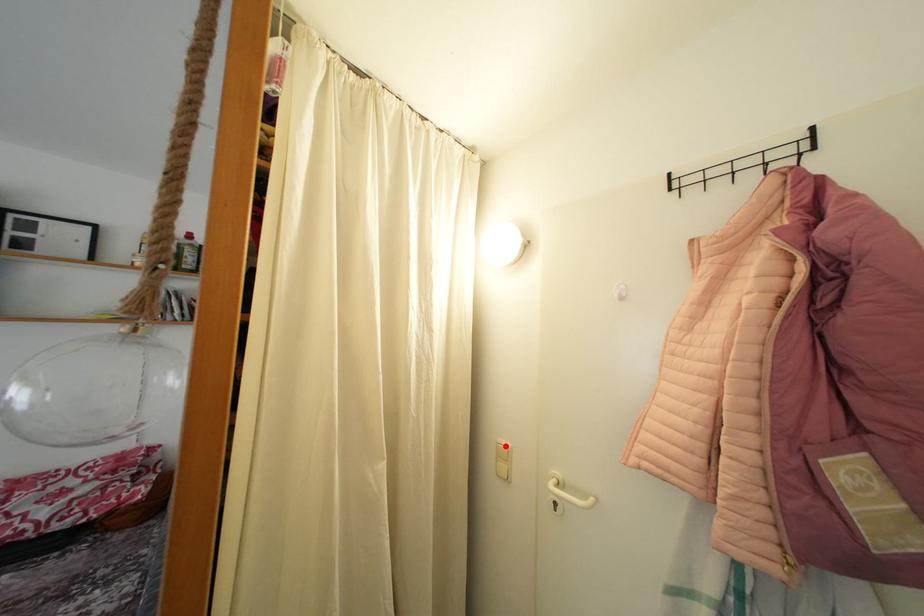
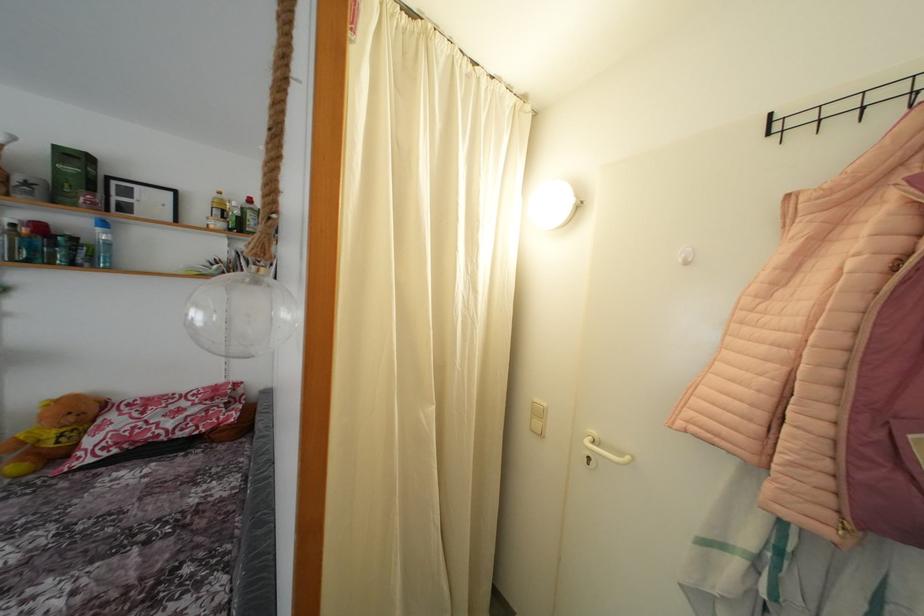
In the second image, find the point that corresponds to the highlighted location in the first image.

(541, 406)